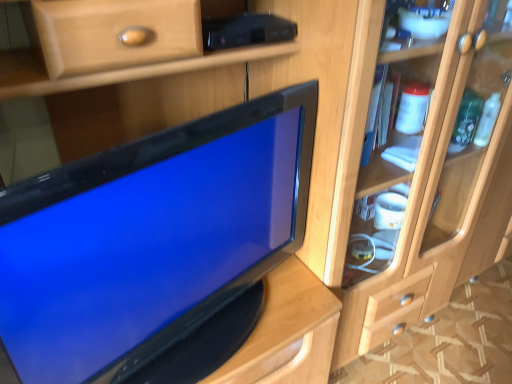
Question: From the image's perspective, is light wood cabinet at right positioned above or below matte black tv at center?

Choices:
 (A) below
 (B) above

Answer: (B)

Question: Is light wood cabinet at right to the left or to the right of matte black tv at center in the image?

Choices:
 (A) left
 (B) right

Answer: (B)

Question: Is light wood cabinet at right inside the boundaries of matte black tv at center, or outside?

Choices:
 (A) inside
 (B) outside

Answer: (B)

Question: From the image's perspective, relative to light wood cabinet at right, is matte black tv at center above or below?

Choices:
 (A) below
 (B) above

Answer: (A)

Question: From a real-world perspective, relative to light wood cabinet at right, is matte black tv at center vertically above or below?

Choices:
 (A) above
 (B) below

Answer: (A)

Question: In terms of height, does matte black tv at center look taller or shorter compared to light wood cabinet at right?

Choices:
 (A) tall
 (B) short

Answer: (B)

Question: In the image, is matte black tv at center positioned in front of or behind light wood cabinet at right?

Choices:
 (A) behind
 (B) front

Answer: (B)